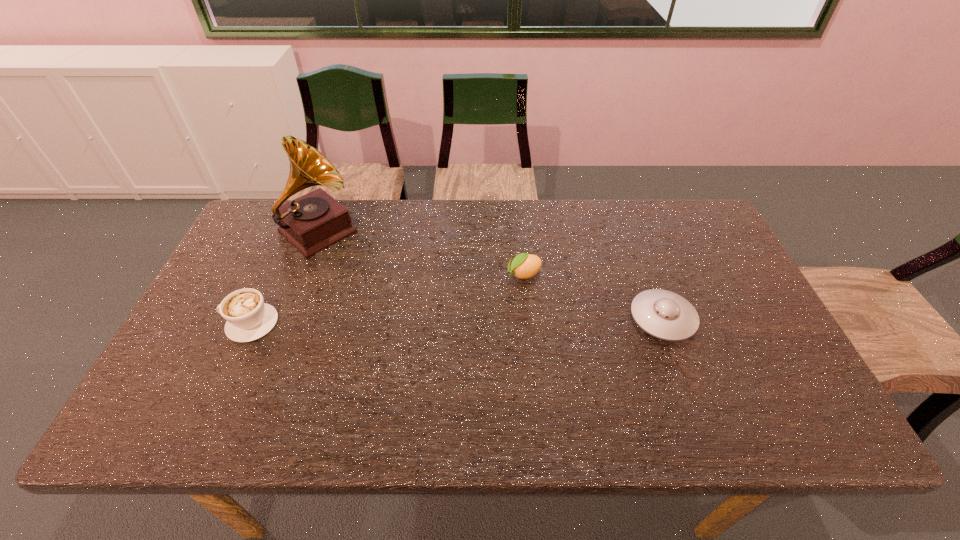
Image resolution: width=960 pixels, height=540 pixels. Identify the location of free space on the desktop that is between the cappuccino and the rightmost object and is positioned from the horn of the phonograph record. (421, 321).

Where is `vacant space on the desktop that is between the cappuccino and the saucer and is positioned with leaves positioned above the second object from right to left`? vacant space on the desktop that is between the cappuccino and the saucer and is positioned with leaves positioned above the second object from right to left is located at coordinates (427, 321).